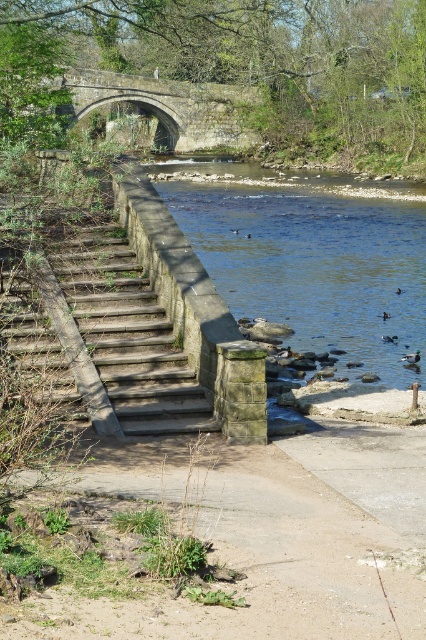
Question: Which point is closer to the camera taking this photo?

Choices:
 (A) (397, 292)
 (B) (327, 522)

Answer: (B)

Question: Can you confirm if concrete sidewalk at lower center is positioned to the left of green glossy duck at lower right?

Choices:
 (A) no
 (B) yes

Answer: (B)

Question: Does concrete sidewalk at lower center appear under brown fuzzy duck at lower right?

Choices:
 (A) no
 (B) yes

Answer: (B)

Question: Which object is positioned farthest from the concrete sidewalk at lower center?

Choices:
 (A) brown fuzzy duck at lower right
 (B) green matte duck at lower right

Answer: (A)

Question: Can you confirm if concrete sidewalk at lower center is positioned to the left of stone arch bridge at upper center?

Choices:
 (A) no
 (B) yes

Answer: (A)

Question: Which of these objects is positioned closest to the brown fuzzy duck at center?

Choices:
 (A) stone steps at left
 (B) concrete sidewalk at lower center
 (C) green glossy duck at lower right
 (D) brown fuzzy duck at lower right

Answer: (D)